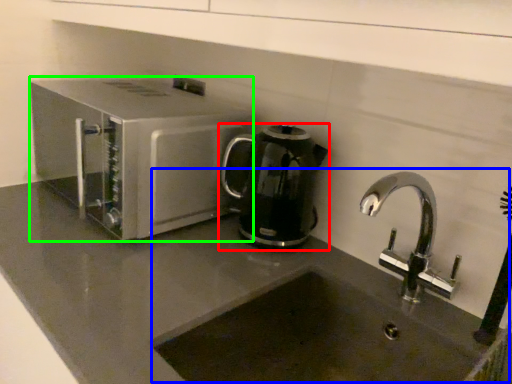
Question: Which object is the closest to the kitchen appliance (highlighted by a red box)? Choose among these: sink (highlighted by a blue box) or home appliance (highlighted by a green box).

Choices:
 (A) sink
 (B) home appliance

Answer: (A)